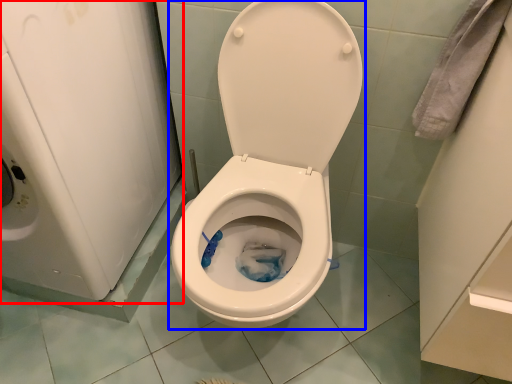
Question: Among these objects, which one is farthest to the camera, appliance (highlighted by a red box) or toilet (highlighted by a blue box)?

Choices:
 (A) appliance
 (B) toilet

Answer: (B)